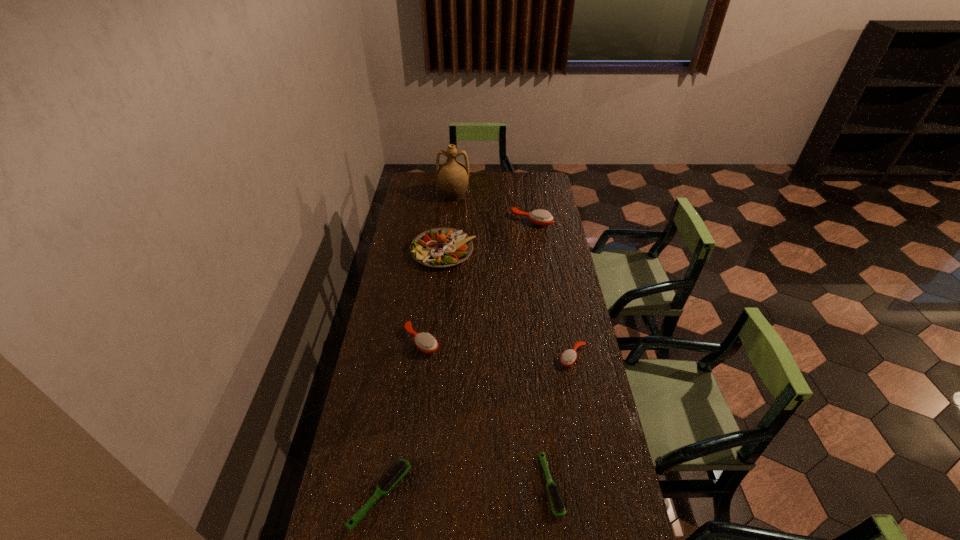
In order to click on free space that satisfies the following two spatial constraints: 1. on the front side of the biggest orange hairbrush; 2. on the right side of the smallest orange hairbrush in this screenshot , I will do `click(553, 357)`.